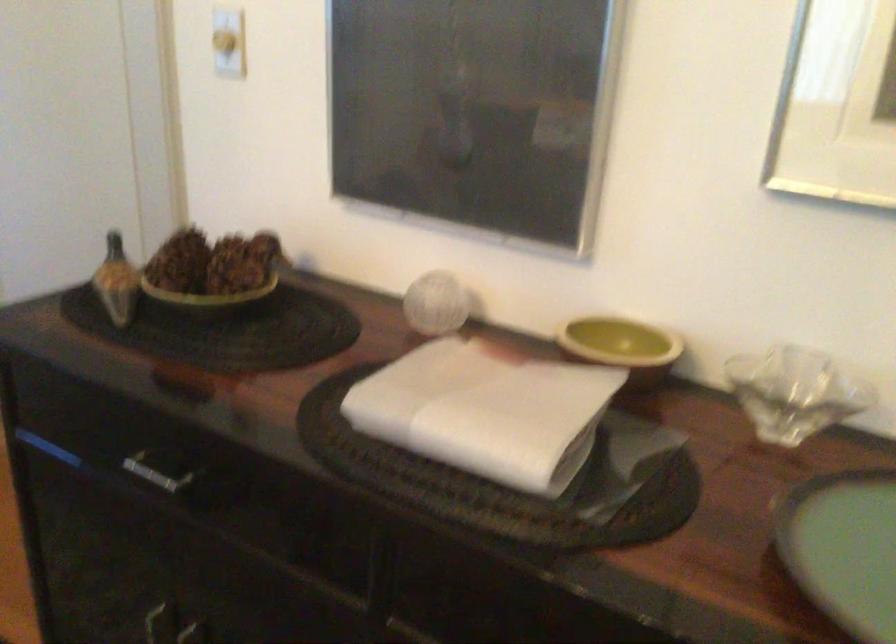
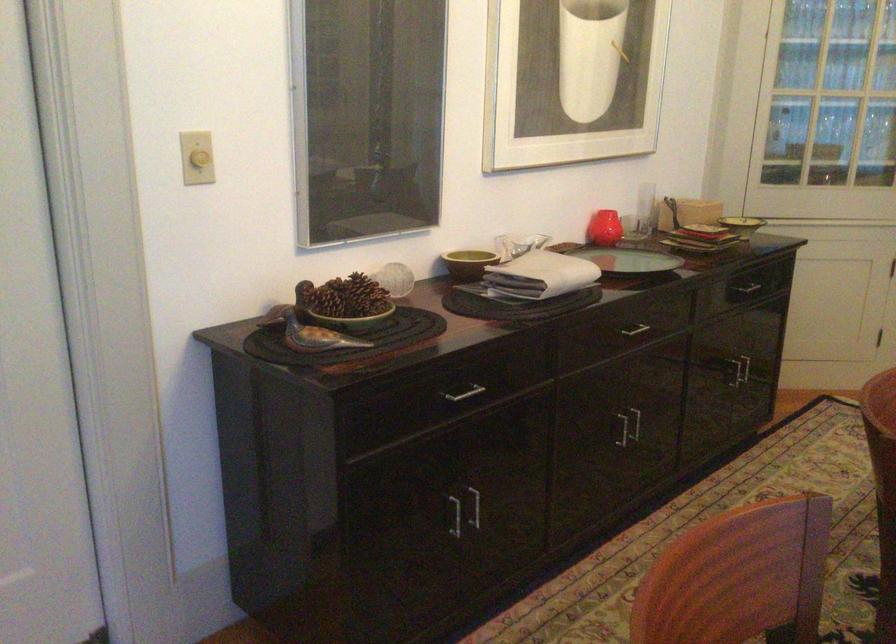
Locate, in the second image, the point that corresponds to point (130, 303) in the first image.

(312, 333)